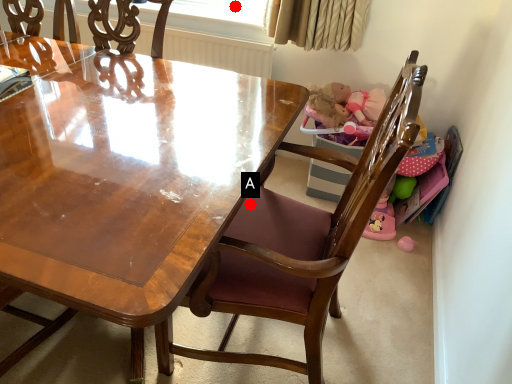
Question: Two points are circled on the image, labeled by A and B beside each circle. Which point appears farthest from the camera in this image?

Choices:
 (A) A is further
 (B) B is further

Answer: (B)